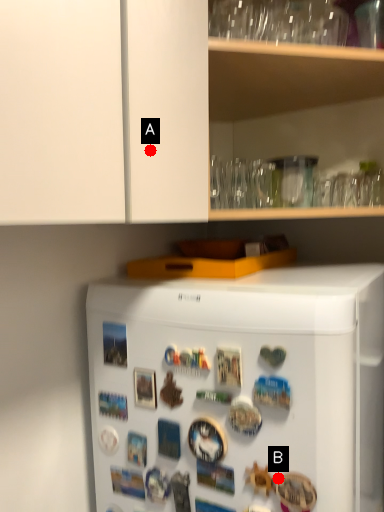
Question: Two points are circled on the image, labeled by A and B beside each circle. Which point appears farthest from the camera in this image?

Choices:
 (A) A is further
 (B) B is further

Answer: (B)